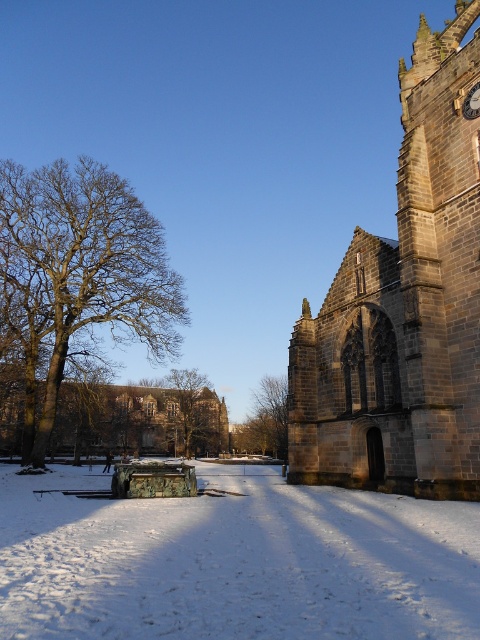
Does brown leafless tree at left have a smaller size compared to green leafy tree at center?

Incorrect, brown leafless tree at left is not smaller in size than green leafy tree at center.

Locate an element on the screen. The image size is (480, 640). brown leafless tree at left is located at coordinates (91, 262).

What do you see at coordinates (91, 262) in the screenshot? Image resolution: width=480 pixels, height=640 pixels. I see `brown leafless tree at left` at bounding box center [91, 262].

This screenshot has width=480, height=640. Identify the location of brown leafless tree at left. (91, 262).

In the scene shown: Between brown leafless tree at center and gold metallic clock at upper right, which one appears on the left side from the viewer's perspective?

Positioned to the left is brown leafless tree at center.

Can you confirm if brown leafless tree at center is shorter than gold metallic clock at upper right?

No, brown leafless tree at center is not shorter than gold metallic clock at upper right.

Find the location of a particular element. brown leafless tree at center is located at coordinates (187, 396).